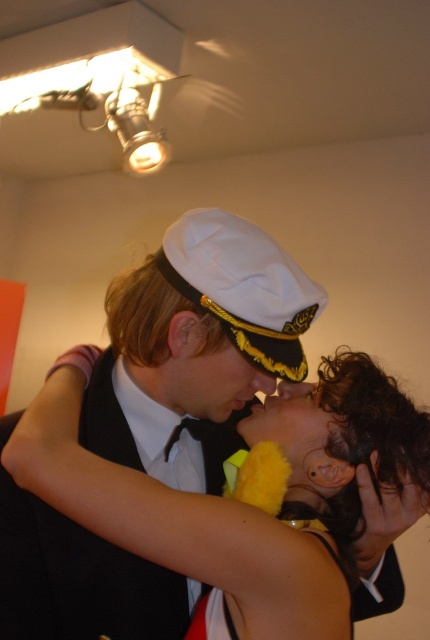
Question: Which of the following is the closest to the observer?

Choices:
 (A) (306, 458)
 (B) (248, 378)
 (C) (252, 518)

Answer: (C)

Question: Which point is farther to the camera?

Choices:
 (A) (347, 465)
 (B) (362, 426)
 (C) (183, 378)

Answer: (C)

Question: Is matte yellow fabric at center thinner than matte white cap at center?

Choices:
 (A) no
 (B) yes

Answer: (A)

Question: Which point is closer to the camera?

Choices:
 (A) matte white cap at center
 (B) matte yellow fabric at center

Answer: (B)

Question: Is matte yellow fabric at center behind matte white cap at center?

Choices:
 (A) no
 (B) yes

Answer: (A)

Question: Can you confirm if matte yellow fabric at center is positioned below matte white cap at center?

Choices:
 (A) yes
 (B) no

Answer: (A)